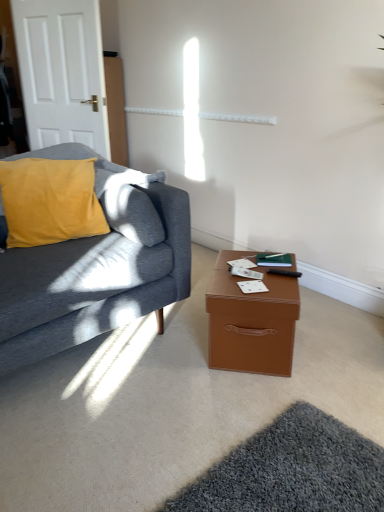
The image size is (384, 512). What do you see at coordinates (62, 72) in the screenshot?
I see `white matte door at upper left` at bounding box center [62, 72].

What is the approximate width of white matte door at upper left?

4.01 inches.

Where is `brown leather-like box at lower right`? This screenshot has width=384, height=512. brown leather-like box at lower right is located at coordinates (251, 321).

Identify the location of velvet mustard pillow at left. The width and height of the screenshot is (384, 512). (96, 267).

Identify the location of remote control lying above the brown leather-like box at lower right (from the image's perspective). This screenshot has height=512, width=384. (285, 273).

In the scene shown: Is black plastic remote control at lower right next to brown leather-like box at lower right?

No, black plastic remote control at lower right is not beside brown leather-like box at lower right.

Considering the sizes of objects black plastic remote control at lower right and brown leather-like box at lower right in the image provided, who is wider, black plastic remote control at lower right or brown leather-like box at lower right?

Wider between the two is brown leather-like box at lower right.

Considering the points (282, 273) and (260, 342), which point is in front, point (282, 273) or point (260, 342)?

The point (260, 342) is in front.

Consider the image. From the image's perspective, relative to black plastic remote control at lower right, is velvet yellow pillow at left above or below?

Based on their image positions, velvet yellow pillow at left is located above black plastic remote control at lower right.

Looking at this image, is velvet yellow pillow at left oriented towards black plastic remote control at lower right?

No.

Is velvet yellow pillow at left to the left of black plastic remote control at lower right from the viewer's perspective?

Yes, velvet yellow pillow at left is to the left of black plastic remote control at lower right.

Is velvet mustard pillow at left wider or thinner than brown leather-like box at lower right?

In the image, velvet mustard pillow at left appears to be wider than brown leather-like box at lower right.

Is velvet mustard pillow at left not within brown leather-like box at lower right?

That's correct, velvet mustard pillow at left is outside of brown leather-like box at lower right.

Considering the positions of objects velvet mustard pillow at left and brown leather-like box at lower right in the image provided, who is behind, velvet mustard pillow at left or brown leather-like box at lower right?

brown leather-like box at lower right is behind.

Does point (148, 178) appear closer or farther from the camera than point (279, 362)?

Clearly, point (148, 178) is more distant from the camera than point (279, 362).

Is black plastic remote control at lower right with velvet yellow pillow at left?

No, black plastic remote control at lower right is not in contact with velvet yellow pillow at left.

Between black plastic remote control at lower right and velvet yellow pillow at left, which one is positioned behind?

black plastic remote control at lower right is further away from the camera.

Could you tell me if black plastic remote control at lower right is turned towards velvet yellow pillow at left?

No, black plastic remote control at lower right is not aimed at velvet yellow pillow at left.

From a real-world perspective, is black plastic remote control at lower right positioned over velvet yellow pillow at left based on gravity?

No.

Locate an element on the screen. studio couch below the velvet yellow pillow at left (from the image's perspective) is located at coordinates (96, 267).

Is velvet mustard pillow at left thinner than velvet yellow pillow at left?

Incorrect, the width of velvet mustard pillow at left is not less than that of velvet yellow pillow at left.

From a real-world perspective, who is located higher, velvet mustard pillow at left or velvet yellow pillow at left?

In real-world perspective, velvet yellow pillow at left is above.

Is velvet mustard pillow at left smaller than velvet yellow pillow at left?

No, velvet mustard pillow at left is not smaller than velvet yellow pillow at left.

Based on the photo, is velvet mustard pillow at left touching black plastic remote control at lower right?

velvet mustard pillow at left and black plastic remote control at lower right are not in contact.

From a real-world perspective, is velvet mustard pillow at left above or below black plastic remote control at lower right?

In terms of real-world spatial position, velvet mustard pillow at left is above black plastic remote control at lower right.

Is velvet mustard pillow at left taller or shorter than black plastic remote control at lower right?

Clearly, velvet mustard pillow at left is taller compared to black plastic remote control at lower right.

Consider the image. Who is smaller, velvet mustard pillow at left or black plastic remote control at lower right?

black plastic remote control at lower right is smaller.

From a real-world perspective, which object stands above the other?

From a 3D spatial view, white matte door at upper left is above.

Is there a large distance between white matte door at upper left and velvet mustard pillow at left?

Yes, white matte door at upper left is far from velvet mustard pillow at left.

In terms of width, does white matte door at upper left look wider or thinner when compared to velvet mustard pillow at left?

Clearly, white matte door at upper left has less width compared to velvet mustard pillow at left.

Find the location of a particular element. desk in front of the black plastic remote control at lower right is located at coordinates (251, 321).

Find the location of `remote control behind the velvet yellow pillow at left`. remote control behind the velvet yellow pillow at left is located at coordinates (285, 273).

Considering their positions, is velvet mustard pillow at left positioned closer to white matte door at upper left than black plastic remote control at lower right?

The object closer to white matte door at upper left is velvet mustard pillow at left.

From the image, which object appears to be farther from brown leather-like box at lower right, velvet mustard pillow at left or white matte door at upper left?

white matte door at upper left lies further to brown leather-like box at lower right than the other object.

Which object lies nearer to the anchor point brown leather-like box at lower right, velvet mustard pillow at left or velvet yellow pillow at left?

Among the two, velvet mustard pillow at left is located nearer to brown leather-like box at lower right.

Considering their positions, is velvet yellow pillow at left positioned closer to brown leather-like box at lower right than white matte door at upper left?

Result: velvet yellow pillow at left lies closer to brown leather-like box at lower right than the other object.

When comparing their distances from black plastic remote control at lower right, does velvet yellow pillow at left or velvet mustard pillow at left seem further?

velvet yellow pillow at left.

When comparing their distances from black plastic remote control at lower right, does white matte door at upper left or brown leather-like box at lower right seem closer?

brown leather-like box at lower right is positioned closer to the anchor black plastic remote control at lower right.

When comparing their distances from white matte door at upper left, does velvet yellow pillow at left or black plastic remote control at lower right seem further?

black plastic remote control at lower right is further to white matte door at upper left.

Based on their spatial positions, is velvet mustard pillow at left or black plastic remote control at lower right further from velvet yellow pillow at left?

black plastic remote control at lower right lies further to velvet yellow pillow at left than the other object.

Identify the location of remote control between white matte door at upper left and brown leather-like box at lower right in the vertical direction. Image resolution: width=384 pixels, height=512 pixels. (285, 273).

Find the location of `pillow located between velvet mustard pillow at left and brown leather-like box at lower right in the left-right direction`. pillow located between velvet mustard pillow at left and brown leather-like box at lower right in the left-right direction is located at coordinates (50, 201).

Find the location of a particular element. This screenshot has height=512, width=384. studio couch between white matte door at upper left and brown leather-like box at lower right from top to bottom is located at coordinates (96, 267).

You are a GUI agent. You are given a task and a screenshot of the screen. Output one action in this format:
    pyautogui.click(x=<x>, y=<y>)
    Task: Click on the studio couch between white matte door at upper left and black plastic remote control at lower right from top to bottom
    
    Given the screenshot: What is the action you would take?
    (96, 267)